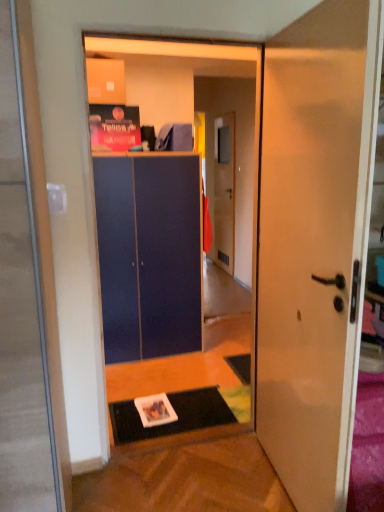
Identify the location of matte blue cabinet at center. (149, 254).

Describe the element at coordinates (186, 93) in the screenshot. This screenshot has height=512, width=384. I see `blue matte cabinet at center` at that location.

What do you see at coordinates (176, 414) in the screenshot?
I see `black rubber doormat at lower center` at bounding box center [176, 414].

Describe the element at coordinates (315, 242) in the screenshot. I see `white glossy door at center, the 2th door when ordered from back to front` at that location.

Identify the location of white glossy door at center, the first door from the front. (315, 242).

Identify the location of matte blue cabinet at center. The width and height of the screenshot is (384, 512). (149, 254).

Can you tell me how much wooden door at center, which is counted as the 2th door, starting from the front, and white glossy door at center, the first door from the front, differ in facing direction?

They differ by 4.16 degrees in their facing directions.

Which is behind, point (215, 259) or point (303, 66)?

Point (215, 259)

Is wooden door at center, which appears as the 1th door when viewed from the back, situated inside white glossy door at center, the first door from the front, or outside?

The correct answer is: outside.

Is wooden door at center, which is counted as the 2th door, starting from the front, next to white glossy door at center, the 2th door when ordered from back to front?

No, wooden door at center, which is counted as the 2th door, starting from the front, is not making contact with white glossy door at center, the 2th door when ordered from back to front.

Considering the relative sizes of white glossy door at center, the 2th door when ordered from back to front, and wooden door at center, which is counted as the 2th door, starting from the front, in the image provided, is white glossy door at center, the 2th door when ordered from back to front, bigger than wooden door at center, which is counted as the 2th door, starting from the front,?

Indeed, white glossy door at center, the 2th door when ordered from back to front, has a larger size compared to wooden door at center, which is counted as the 2th door, starting from the front.

Is white glossy door at center, the 2th door when ordered from back to front, in front of or behind wooden door at center, which appears as the 1th door when viewed from the back, in the image?

white glossy door at center, the 2th door when ordered from back to front, is positioned closer to the viewer than wooden door at center, which appears as the 1th door when viewed from the back.

Can we say white glossy door at center, the 2th door when ordered from back to front, lies outside wooden door at center, which appears as the 1th door when viewed from the back?

Absolutely, white glossy door at center, the 2th door when ordered from back to front, is external to wooden door at center, which appears as the 1th door when viewed from the back.

Locate an element on the screen. door in front of the wooden door at center, which appears as the 1th door when viewed from the back is located at coordinates (315, 242).

In terms of height, does wooden door at center, which is counted as the 2th door, starting from the front, look taller or shorter compared to black rubber doormat at lower center?

In the image, wooden door at center, which is counted as the 2th door, starting from the front, appears to be taller than black rubber doormat at lower center.

Considering the positions of objects wooden door at center, which is counted as the 2th door, starting from the front, and black rubber doormat at lower center in the image provided, who is more to the right, wooden door at center, which is counted as the 2th door, starting from the front, or black rubber doormat at lower center?

wooden door at center, which is counted as the 2th door, starting from the front.

From the image's perspective, which is above, wooden door at center, which appears as the 1th door when viewed from the back, or black rubber doormat at lower center?

wooden door at center, which appears as the 1th door when viewed from the back, appears higher in the image.

Could you tell me if wooden door at center, which appears as the 1th door when viewed from the back, is facing black rubber doormat at lower center?

No.

Is wooden door at center, which is counted as the 2th door, starting from the front, positioned in front of blue matte cabinet at center?

No.

From a real-world perspective, is wooden door at center, which is counted as the 2th door, starting from the front, above or below blue matte cabinet at center?

wooden door at center, which is counted as the 2th door, starting from the front, is below blue matte cabinet at center.

Is wooden door at center, which appears as the 1th door when viewed from the back, wider or thinner than blue matte cabinet at center?

Considering their sizes, wooden door at center, which appears as the 1th door when viewed from the back, looks slimmer than blue matte cabinet at center.

Considering the points (220, 148) and (166, 46), which point is in front, point (220, 148) or point (166, 46)?

The point (166, 46) is more forward.

Are black rubber doormat at lower center and wooden door at center, which is counted as the 2th door, starting from the front, located far from each other?

Yes, black rubber doormat at lower center is far from wooden door at center, which is counted as the 2th door, starting from the front.

Is black rubber doormat at lower center facing away from wooden door at center, which appears as the 1th door when viewed from the back?

black rubber doormat at lower center is not turned away from wooden door at center, which appears as the 1th door when viewed from the back.

In terms of width, does black rubber doormat at lower center look wider or thinner when compared to wooden door at center, which is counted as the 2th door, starting from the front?

black rubber doormat at lower center is wider than wooden door at center, which is counted as the 2th door, starting from the front.

Looking at this image, how different are the orientations of black rubber doormat at lower center and wooden door at center, which appears as the 1th door when viewed from the back, in degrees?

The facing directions of black rubber doormat at lower center and wooden door at center, which appears as the 1th door when viewed from the back, are 90.2 degrees apart.

Would you consider blue matte cabinet at center to be distant from matte blue cabinet at center?

No, blue matte cabinet at center is not far from matte blue cabinet at center.

From a real-world perspective, who is located lower, blue matte cabinet at center or matte blue cabinet at center?

In real-world perspective, matte blue cabinet at center is lower.

Is blue matte cabinet at center bigger or smaller than matte blue cabinet at center?

In the image, blue matte cabinet at center appears to be smaller than matte blue cabinet at center.

Based on the photo, is blue matte cabinet at center thinner than matte blue cabinet at center?

Indeed, blue matte cabinet at center has a lesser width compared to matte blue cabinet at center.

Is matte blue cabinet at center positioned behind blue matte cabinet at center?

Yes, it is.

Consider the image. From a real-world perspective, is matte blue cabinet at center beneath blue matte cabinet at center?

Yes, from a real-world perspective, matte blue cabinet at center is beneath blue matte cabinet at center.

Is matte blue cabinet at center located outside blue matte cabinet at center?

Absolutely, matte blue cabinet at center is external to blue matte cabinet at center.

Consider the image. Is matte blue cabinet at center facing away from blue matte cabinet at center?

matte blue cabinet at center is not turned away from blue matte cabinet at center.

You are a GUI agent. You are given a task and a screenshot of the screen. Output one action in this format:
    pyautogui.click(x=<x>, y=<y>)
    Task: Click on the door that appears above the wooden door at center, which is counted as the 2th door, starting from the front (from a real-world perspective)
    The image size is (384, 512).
    Given the screenshot: What is the action you would take?
    pyautogui.click(x=315, y=242)

The height and width of the screenshot is (512, 384). What are the coordinates of `door that is on the right side of wooden door at center, which is counted as the 2th door, starting from the front` in the screenshot? It's located at (315, 242).

Considering their positions, is wooden door at center, which is counted as the 2th door, starting from the front, positioned closer to blue matte cabinet at center than matte blue cabinet at center?

Based on the image, matte blue cabinet at center appears to be nearer to blue matte cabinet at center.

In the scene shown: Looking at the image, which one is located closer to blue matte cabinet at center, wooden door at center, which is counted as the 2th door, starting from the front, or black rubber doormat at lower center?

black rubber doormat at lower center.

Estimate the real-world distances between objects in this image. Which object is further from black rubber doormat at lower center, blue matte cabinet at center or wooden door at center, which appears as the 1th door when viewed from the back?

Based on the image, wooden door at center, which appears as the 1th door when viewed from the back, appears to be further to black rubber doormat at lower center.

From the image, which object appears to be farther from wooden door at center, which appears as the 1th door when viewed from the back, white glossy door at center, the first door from the front, or blue matte cabinet at center?

white glossy door at center, the first door from the front.

Considering their positions, is white glossy door at center, the first door from the front, positioned further to blue matte cabinet at center than black rubber doormat at lower center?

The object further to blue matte cabinet at center is black rubber doormat at lower center.

Estimate the real-world distances between objects in this image. Which object is closer to wooden door at center, which is counted as the 2th door, starting from the front, white glossy door at center, the 2th door when ordered from back to front, or black rubber doormat at lower center?

Among the two, black rubber doormat at lower center is located nearer to wooden door at center, which is counted as the 2th door, starting from the front.

Looking at the image, which one is located further to black rubber doormat at lower center, matte blue cabinet at center or white glossy door at center, the first door from the front?

white glossy door at center, the first door from the front.

Based on their spatial positions, is matte blue cabinet at center or wooden door at center, which appears as the 1th door when viewed from the back, further from white glossy door at center, the first door from the front?

Based on the image, wooden door at center, which appears as the 1th door when viewed from the back, appears to be further to white glossy door at center, the first door from the front.

Locate an element on the screen. Image resolution: width=384 pixels, height=512 pixels. cabinetry between black rubber doormat at lower center and wooden door at center, which appears as the 1th door when viewed from the back, along the z-axis is located at coordinates tap(149, 254).

Find the location of a particular element. The image size is (384, 512). cabinetry between blue matte cabinet at center and wooden door at center, which is counted as the 2th door, starting from the front, along the z-axis is located at coordinates (149, 254).

Identify the location of doormat between white glossy door at center, the first door from the front, and wooden door at center, which is counted as the 2th door, starting from the front, from front to back. (176, 414).

Where is `bookstore located between white glossy door at center, the first door from the front, and matte blue cabinet at center in the depth direction`? bookstore located between white glossy door at center, the first door from the front, and matte blue cabinet at center in the depth direction is located at coordinates (186, 93).